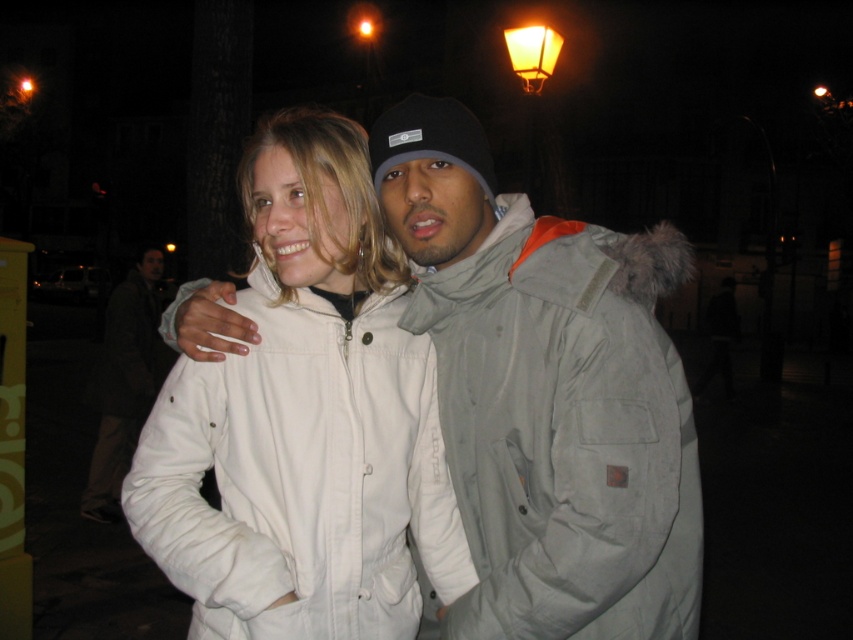
Does white cotton jacket at center lie behind orange frosted glass streetlamp at upper right?

No, white cotton jacket at center is in front of orange frosted glass streetlamp at upper right.

Does white cotton jacket at center have a greater height compared to orange frosted glass streetlamp at upper right?

Indeed, white cotton jacket at center has a greater height compared to orange frosted glass streetlamp at upper right.

Is point (123, 349) less distant than point (546, 65)?

Yes, point (123, 349) is in front of point (546, 65).

The height and width of the screenshot is (640, 853). I want to click on white cotton jacket at center, so click(125, 384).

Is gray fabric jacket at center smaller than white cotton jacket at center?

Yes.

Between gray fabric jacket at center and white cotton jacket at center, which one appears on the right side from the viewer's perspective?

gray fabric jacket at center is more to the right.

You are a GUI agent. You are given a task and a screenshot of the screen. Output one action in this format:
    pyautogui.click(x=<x>, y=<y>)
    Task: Click on the gray fabric jacket at center
    This screenshot has height=640, width=853.
    Given the screenshot: What is the action you would take?
    547,394

What do you see at coordinates (547, 394) in the screenshot? The height and width of the screenshot is (640, 853). I see `gray fabric jacket at center` at bounding box center [547, 394].

Is point (672, 269) more distant than point (345, 624)?

Yes, point (672, 269) is farther from viewer.

Locate an element on the screen. This screenshot has width=853, height=640. gray fabric jacket at center is located at coordinates (547, 394).